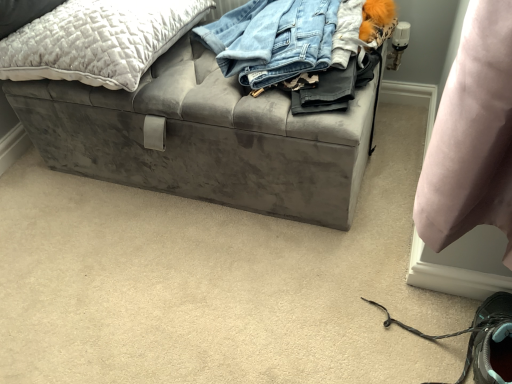
Find the location of a particular element. The height and width of the screenshot is (384, 512). blank area to the left of gray suede shoe at lower right is located at coordinates (300, 322).